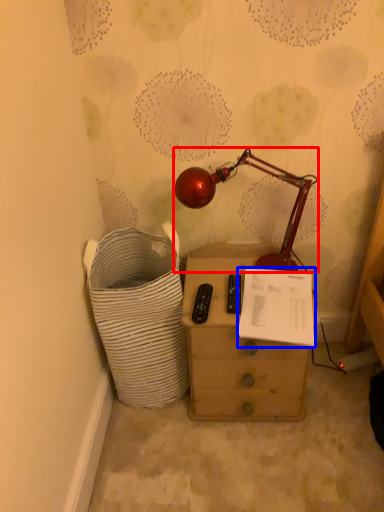
Question: Which point is further to the camera, lamp (highlighted by a red box) or document (highlighted by a blue box)?

Choices:
 (A) lamp
 (B) document

Answer: (B)